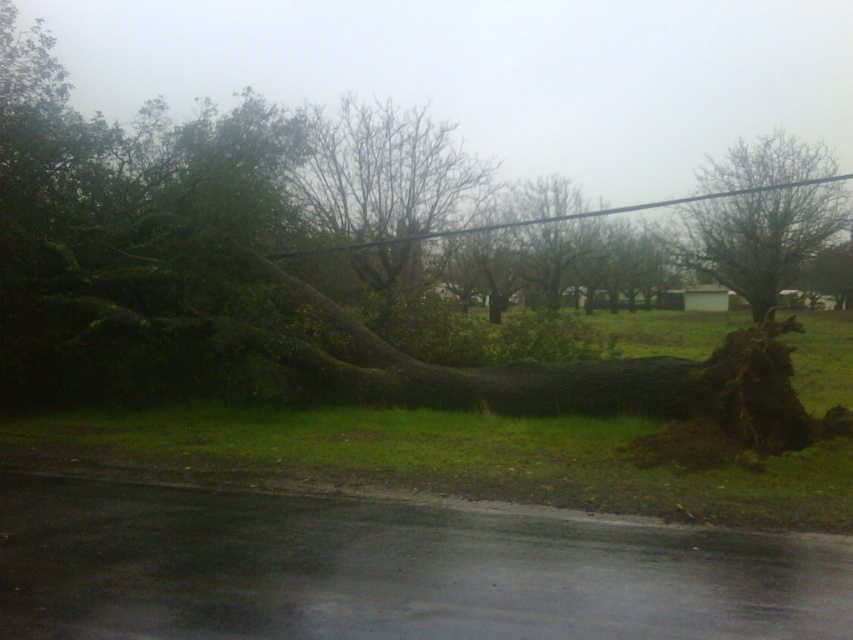
Consider the image. Who is more distant from viewer, (404, 192) or (442, 234)?

Positioned behind is point (404, 192).

Does point (463, 196) lie in front of point (526, 224)?

Yes, it is.

Is point (456, 189) positioned after point (527, 220)?

No, (456, 189) is closer to viewer.

Locate an element on the screen. This screenshot has width=853, height=640. bare branches at center is located at coordinates (386, 184).

Between dark brown wood at center and bare wood tree at center, which one is positioned lower?

bare wood tree at center is below.

Between dark brown wood at center and bare wood tree at center, which one appears on the right side from the viewer's perspective?

Positioned to the right is bare wood tree at center.

Locate an element on the screen. The height and width of the screenshot is (640, 853). dark brown wood at center is located at coordinates (x=332, y=253).

Is point (764, 260) in front of point (289, 257)?

That is False.

Where is `bare wood tree at center`? bare wood tree at center is located at coordinates (761, 216).

Is point (757, 182) closer to viewer compared to point (419, 237)?

No, it is not.

Where is `bare wood tree at center`? This screenshot has height=640, width=853. bare wood tree at center is located at coordinates click(x=761, y=216).